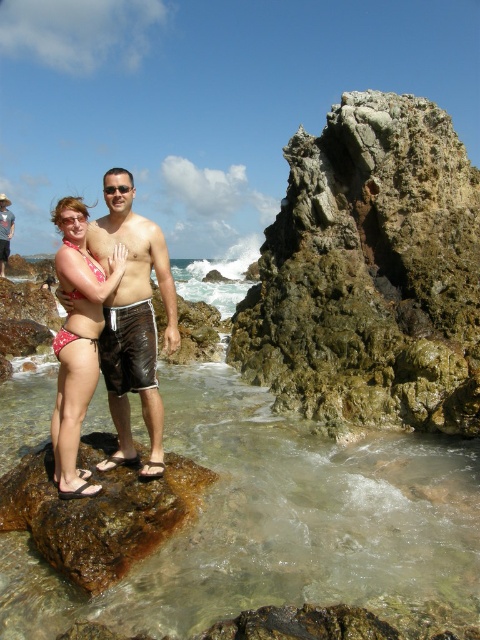
Who is more distant from viewer, (0, 464) or (112, 308)?

Positioned behind is point (0, 464).

Where is `clear water at rock center`? This screenshot has width=480, height=640. clear water at rock center is located at coordinates (278, 524).

Identify the location of clear water at rock center. This screenshot has height=640, width=480. (278, 524).

Between clear water at rock center and printed bikini bottom at center, which one has more height?

Standing taller between the two is printed bikini bottom at center.

Does clear water at rock center lie in front of printed bikini bottom at center?

Yes, clear water at rock center is in front of printed bikini bottom at center.

Where is `clear water at rock center`? The image size is (480, 640). clear water at rock center is located at coordinates pos(278,524).

Where is `clear water at rock center`? clear water at rock center is located at coordinates point(278,524).

Can you confirm if shiny brown shorts at center is positioned to the right of printed bikini bottom at center?

Yes, shiny brown shorts at center is to the right of printed bikini bottom at center.

Between shiny brown shorts at center and printed bikini bottom at center, which one appears on the right side from the viewer's perspective?

From the viewer's perspective, shiny brown shorts at center appears more on the right side.

Does point (170, 330) come farther from viewer compared to point (87, 369)?

Yes, point (170, 330) is behind point (87, 369).

Locate an element on the screen. Image resolution: width=480 pixels, height=640 pixels. shiny brown shorts at center is located at coordinates (132, 321).